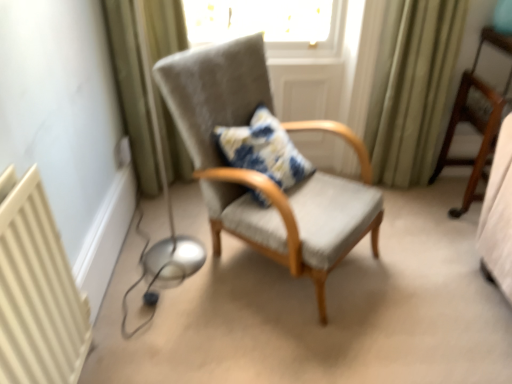
You are a GUI agent. You are given a task and a screenshot of the screen. Output one action in this format:
    pyautogui.click(x=<x>, y=<y>)
    Task: Click on the textured gray armchair at center, marked as the 1th chair in a left-to-right arrangement
    This screenshot has height=384, width=512.
    Given the screenshot: What is the action you would take?
    pyautogui.click(x=262, y=174)

What is the approximate width of white plastic electric outlet at lower left?

The width of white plastic electric outlet at lower left is 4.85 centimeters.

Image resolution: width=512 pixels, height=384 pixels. What do you see at coordinates (132, 91) in the screenshot? I see `green fabric curtain at left, arranged as the 1th curtain when viewed from the left` at bounding box center [132, 91].

What are the coordinates of `wooden chair at right, which is the 2th chair in left-to-right order` in the screenshot? It's located at (476, 119).

Locate an element on the screen. textured gray armchair at center, the second chair viewed from the right is located at coordinates (262, 174).

Where is `the 2nd chair in front of the green fabric curtain at right, which is the second curtain from left to right, counting from the anchor's position`? the 2nd chair in front of the green fabric curtain at right, which is the second curtain from left to right, counting from the anchor's position is located at coordinates (262, 174).

In terms of size, does textured gray armchair at center, the second chair viewed from the right, appear bigger or smaller than green fabric curtain at right, which is the second curtain from left to right?

textured gray armchair at center, the second chair viewed from the right, is bigger than green fabric curtain at right, which is the second curtain from left to right.

Is textured gray armchair at center, the second chair viewed from the right, thinner than green fabric curtain at right, which is the 1th curtain in right-to-left order?

No, textured gray armchair at center, the second chair viewed from the right, is not thinner than green fabric curtain at right, which is the 1th curtain in right-to-left order.

Based on the photo, can you tell me how much wooden chair at right, which is the 2th chair in left-to-right order, and green fabric curtain at left, arranged as the 1th curtain when viewed from the left, differ in facing direction?

The angular difference between wooden chair at right, which is the 2th chair in left-to-right order, and green fabric curtain at left, arranged as the 1th curtain when viewed from the left, is 0.527 degrees.

Is there a large distance between wooden chair at right, which is the 2th chair in left-to-right order, and green fabric curtain at left, arranged as the 1th curtain when viewed from the left?

Yes.

From a real-world perspective, is wooden chair at right, which is the 2th chair in left-to-right order, over green fabric curtain at left, which ranks as the 2th curtain in right-to-left order?

No.

Which of these two, wooden chair at right, which is counted as the first chair, starting from the right, or green fabric curtain at left, arranged as the 1th curtain when viewed from the left, stands shorter?

Standing shorter between the two is wooden chair at right, which is counted as the first chair, starting from the right.

From the image's perspective, which object appears higher, textured gray armchair at center, marked as the 1th chair in a left-to-right arrangement, or white plastic electric outlet at lower left?

white plastic electric outlet at lower left is shown above in the image.

Between point (203, 170) and point (128, 161), which one is positioned behind?

The point (128, 161) is farther.

Does textured gray armchair at center, the second chair viewed from the right, contain white plastic electric outlet at lower left?

Definitely not — white plastic electric outlet at lower left is not inside textured gray armchair at center, the second chair viewed from the right.

Is textured gray armchair at center, marked as the 1th chair in a left-to-right arrangement, shorter than white plastic electric outlet at lower left?

In fact, textured gray armchair at center, marked as the 1th chair in a left-to-right arrangement, may be taller than white plastic electric outlet at lower left.

From the image's perspective, which is above, green fabric curtain at left, which ranks as the 2th curtain in right-to-left order, or textured gray armchair at center, the second chair viewed from the right?

green fabric curtain at left, which ranks as the 2th curtain in right-to-left order.

Can you confirm if green fabric curtain at left, which ranks as the 2th curtain in right-to-left order, is smaller than textured gray armchair at center, marked as the 1th chair in a left-to-right arrangement?

Yes, green fabric curtain at left, which ranks as the 2th curtain in right-to-left order, is smaller than textured gray armchair at center, marked as the 1th chair in a left-to-right arrangement.

Between green fabric curtain at left, arranged as the 1th curtain when viewed from the left, and textured gray armchair at center, marked as the 1th chair in a left-to-right arrangement, which one has smaller width?

green fabric curtain at left, arranged as the 1th curtain when viewed from the left, is thinner.

Are green fabric curtain at left, arranged as the 1th curtain when viewed from the left, and textured gray armchair at center, the second chair viewed from the right, located far from each other?

They are positioned close to each other.

Is blue and white tie-dye pillow at center not near wooden chair at right, which is counted as the first chair, starting from the right?

No, blue and white tie-dye pillow at center is in close proximity to wooden chair at right, which is counted as the first chair, starting from the right.

In the image, is blue and white tie-dye pillow at center on the left side or the right side of wooden chair at right, which is counted as the first chair, starting from the right?

From the image, it's evident that blue and white tie-dye pillow at center is to the left of wooden chair at right, which is counted as the first chair, starting from the right.

Between blue and white tie-dye pillow at center and wooden chair at right, which is the 2th chair in left-to-right order, which one has larger size?

With larger size is wooden chair at right, which is the 2th chair in left-to-right order.

From a real-world perspective, is blue and white tie-dye pillow at center physically above wooden chair at right, which is the 2th chair in left-to-right order?

Yes, from a real-world perspective, blue and white tie-dye pillow at center is over wooden chair at right, which is the 2th chair in left-to-right order

Measure the distance from blue and white tie-dye pillow at center to green fabric curtain at right, which is the 1th curtain in right-to-left order.

28.52 inches.

Based on the photo, is blue and white tie-dye pillow at center at the left side of green fabric curtain at right, which is the 1th curtain in right-to-left order?

Yes.

You are a GUI agent. You are given a task and a screenshot of the screen. Output one action in this format:
    pyautogui.click(x=<x>, y=<y>)
    Task: Click on the 2nd curtain above when counting from the blue and white tie-dye pillow at center (from the image's perspective)
    
    Given the screenshot: What is the action you would take?
    pyautogui.click(x=411, y=87)

Are blue and white tie-dye pillow at center and green fabric curtain at right, which is the 1th curtain in right-to-left order, far apart?

No, blue and white tie-dye pillow at center is not far from green fabric curtain at right, which is the 1th curtain in right-to-left order.

Does green fabric curtain at right, which is the second curtain from left to right, touch blue and white tie-dye pillow at center?

No, green fabric curtain at right, which is the second curtain from left to right, is not making contact with blue and white tie-dye pillow at center.

I want to click on pillow located below the green fabric curtain at right, which is the second curtain from left to right (from the image's perspective), so click(263, 149).

Considering the relative sizes of green fabric curtain at right, which is the second curtain from left to right, and blue and white tie-dye pillow at center in the image provided, is green fabric curtain at right, which is the second curtain from left to right, shorter than blue and white tie-dye pillow at center?

No, green fabric curtain at right, which is the second curtain from left to right, is not shorter than blue and white tie-dye pillow at center.

Consider the image. From the image's perspective, is green fabric curtain at right, which is the second curtain from left to right, located above or below blue and white tie-dye pillow at center?

Based on their image positions, green fabric curtain at right, which is the second curtain from left to right, is located above blue and white tie-dye pillow at center.

You are a GUI agent. You are given a task and a screenshot of the screen. Output one action in this format:
    pyautogui.click(x=<x>, y=<y>)
    Task: Click on the 2nd curtain above the textured gray armchair at center, the second chair viewed from the right (from a real-world perspective)
    
    Given the screenshot: What is the action you would take?
    pyautogui.click(x=411, y=87)

Identify the location of the 1st curtain above when counting from the wooden chair at right, which is counted as the first chair, starting from the right (from the image's perspective). The image size is (512, 384). (132, 91).

Considering their positions, is green fabric curtain at left, arranged as the 1th curtain when viewed from the left, positioned further to white plastic electric outlet at lower left than green fabric curtain at right, which is the 1th curtain in right-to-left order?

green fabric curtain at right, which is the 1th curtain in right-to-left order.

Estimate the real-world distances between objects in this image. Which object is further from green fabric curtain at right, which is the 1th curtain in right-to-left order, wooden chair at right, which is counted as the first chair, starting from the right, or textured gray armchair at center, the second chair viewed from the right?

textured gray armchair at center, the second chair viewed from the right.

Which object lies further to the anchor point textured gray armchair at center, the second chair viewed from the right, wooden chair at right, which is the 2th chair in left-to-right order, or green fabric curtain at left, which ranks as the 2th curtain in right-to-left order?

wooden chair at right, which is the 2th chair in left-to-right order.

Looking at the image, which one is located closer to textured gray armchair at center, the second chair viewed from the right, green fabric curtain at left, arranged as the 1th curtain when viewed from the left, or blue and white tie-dye pillow at center?

Based on the image, blue and white tie-dye pillow at center appears to be nearer to textured gray armchair at center, the second chair viewed from the right.

Estimate the real-world distances between objects in this image. Which object is further from green fabric curtain at right, which is the second curtain from left to right, wooden chair at right, which is the 2th chair in left-to-right order, or green fabric curtain at left, arranged as the 1th curtain when viewed from the left?

The object further to green fabric curtain at right, which is the second curtain from left to right, is green fabric curtain at left, arranged as the 1th curtain when viewed from the left.

When comparing their distances from green fabric curtain at right, which is the 1th curtain in right-to-left order, does blue and white tie-dye pillow at center or green fabric curtain at left, arranged as the 1th curtain when viewed from the left, seem closer?

blue and white tie-dye pillow at center is positioned closer to the anchor green fabric curtain at right, which is the 1th curtain in right-to-left order.

Which object lies nearer to the anchor point blue and white tie-dye pillow at center, textured gray armchair at center, marked as the 1th chair in a left-to-right arrangement, or white plastic electric outlet at lower left?

textured gray armchair at center, marked as the 1th chair in a left-to-right arrangement, is closer to blue and white tie-dye pillow at center.

Considering their positions, is blue and white tie-dye pillow at center positioned further to white plastic electric outlet at lower left than wooden chair at right, which is the 2th chair in left-to-right order?

wooden chair at right, which is the 2th chair in left-to-right order, is further to white plastic electric outlet at lower left.

The height and width of the screenshot is (384, 512). I want to click on pillow between textured gray armchair at center, the second chair viewed from the right, and white plastic electric outlet at lower left from front to back, so click(263, 149).

Locate an element on the screen. The height and width of the screenshot is (384, 512). chair located between white plastic electric outlet at lower left and wooden chair at right, which is counted as the first chair, starting from the right, in the left-right direction is located at coordinates (262, 174).

Locate an element on the screen. The width and height of the screenshot is (512, 384). pillow situated between white plastic electric outlet at lower left and green fabric curtain at right, which is the second curtain from left to right, from left to right is located at coordinates pos(263,149).

The height and width of the screenshot is (384, 512). In order to click on pillow between green fabric curtain at left, arranged as the 1th curtain when viewed from the left, and green fabric curtain at right, which is the 1th curtain in right-to-left order in this screenshot , I will do `click(263, 149)`.